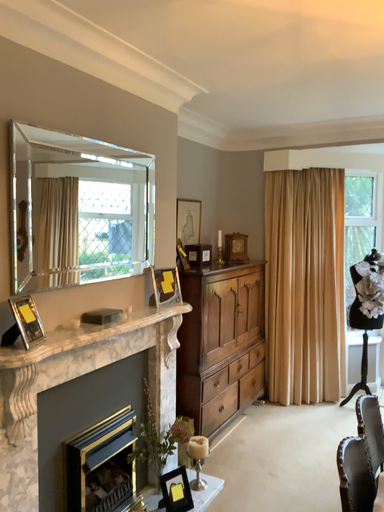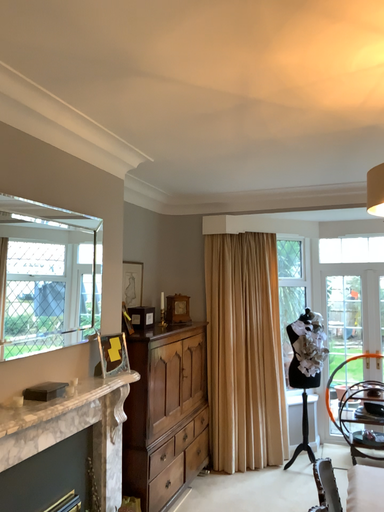
Question: How did the camera likely rotate when shooting the video?

Choices:
 (A) rotated upward
 (B) rotated downward

Answer: (A)